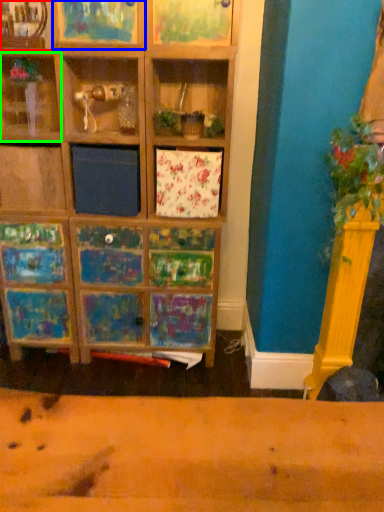
Question: Which object is positioned closest to shelf (highlighted by a red box)? Select from shelf (highlighted by a blue box) and shelf (highlighted by a green box).

Choices:
 (A) shelf
 (B) shelf

Answer: (A)